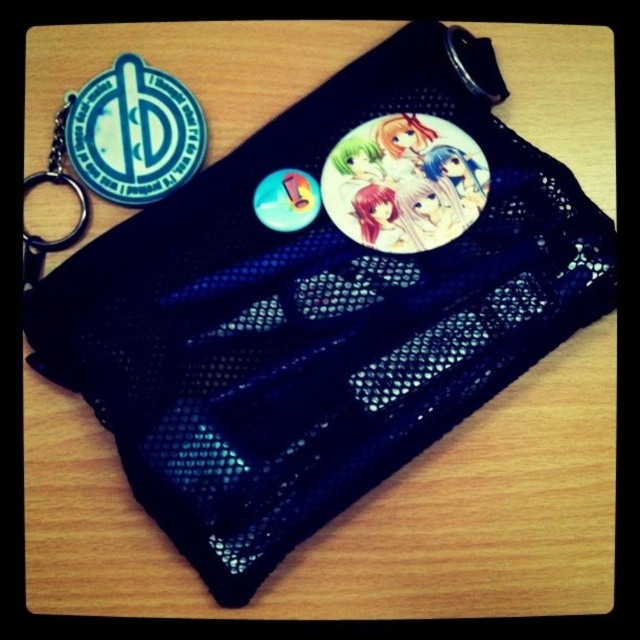
Question: Can you confirm if blue rubber badge at upper left is smaller than metallic silver badge at upper left?

Choices:
 (A) yes
 (B) no

Answer: (B)

Question: Which object is closer to the camera taking this photo?

Choices:
 (A) metallic silver badge at upper left
 (B) blue rubber badge at upper left

Answer: (B)

Question: Is blue rubber badge at upper left positioned before metallic silver badge at upper left?

Choices:
 (A) yes
 (B) no

Answer: (A)

Question: Can you confirm if blue rubber badge at upper left is wider than metallic silver badge at upper left?

Choices:
 (A) yes
 (B) no

Answer: (A)